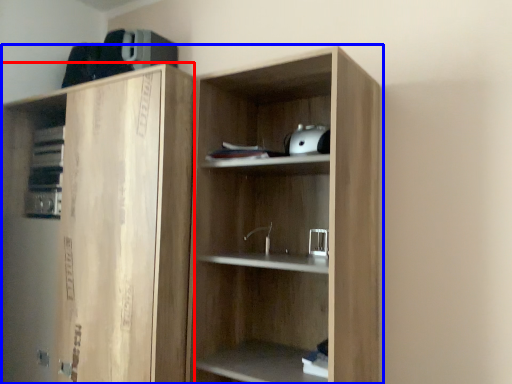
Question: Which of the following is the closest to the observer, cabinetry (highlighted by a red box) or cupboard (highlighted by a blue box)?

Choices:
 (A) cabinetry
 (B) cupboard

Answer: (B)